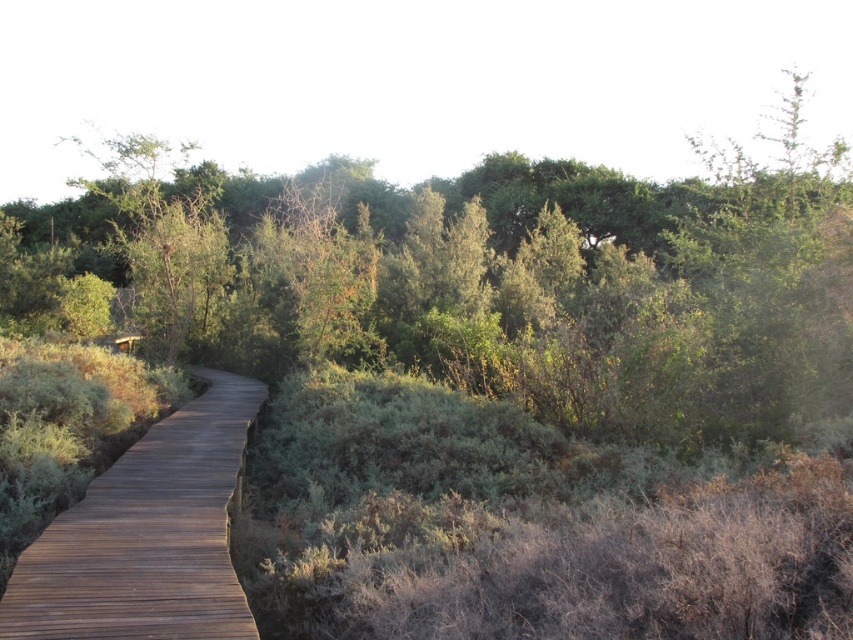
Between wooden boardwalk at center and green leafy tree at upper left, which one is positioned higher?

green leafy tree at upper left is above.

Between wooden boardwalk at center and green leafy tree at upper left, which one appears on the left side from the viewer's perspective?

From the viewer's perspective, green leafy tree at upper left appears more on the left side.

What do you see at coordinates (148, 536) in the screenshot? I see `wooden boardwalk at center` at bounding box center [148, 536].

Where is `wooden boardwalk at center`? wooden boardwalk at center is located at coordinates (148, 536).